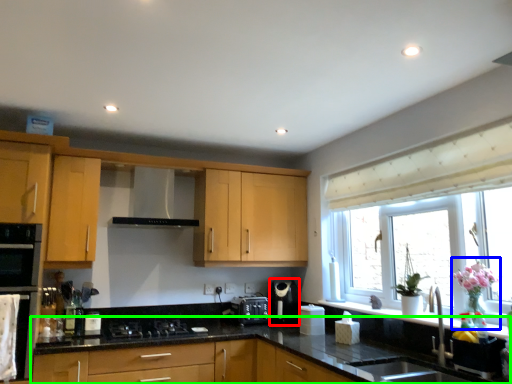
Question: Which object is positioned farthest from coffee machine (highlighted by a red box)? Select from floral arrangement (highlighted by a blue box) and countertop (highlighted by a green box).

Choices:
 (A) floral arrangement
 (B) countertop

Answer: (A)